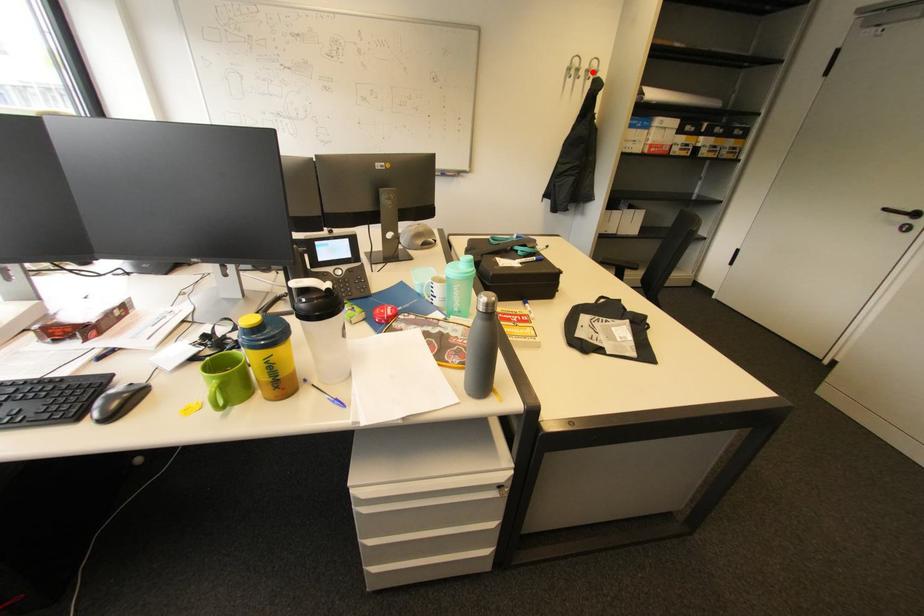
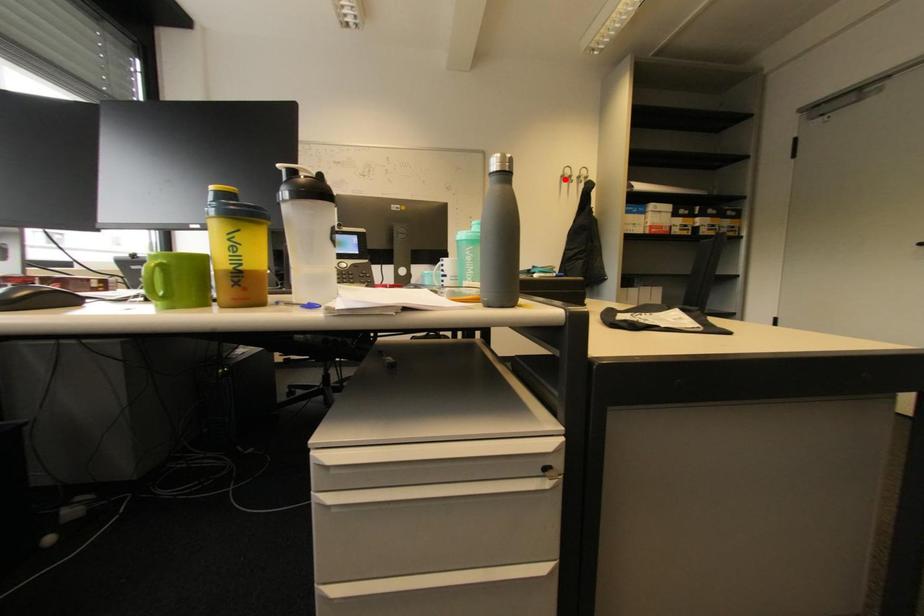
I am providing you with two images of the same scene from different viewpoints. A red point is marked on the first image and another point is marked on the second image. Is the red point in image1 aligned with the point shown in image2?

No